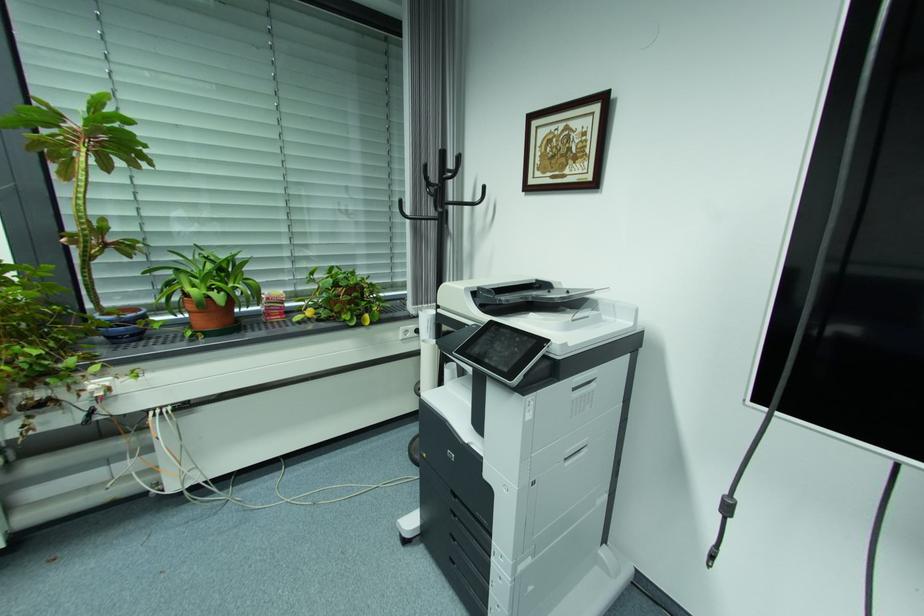
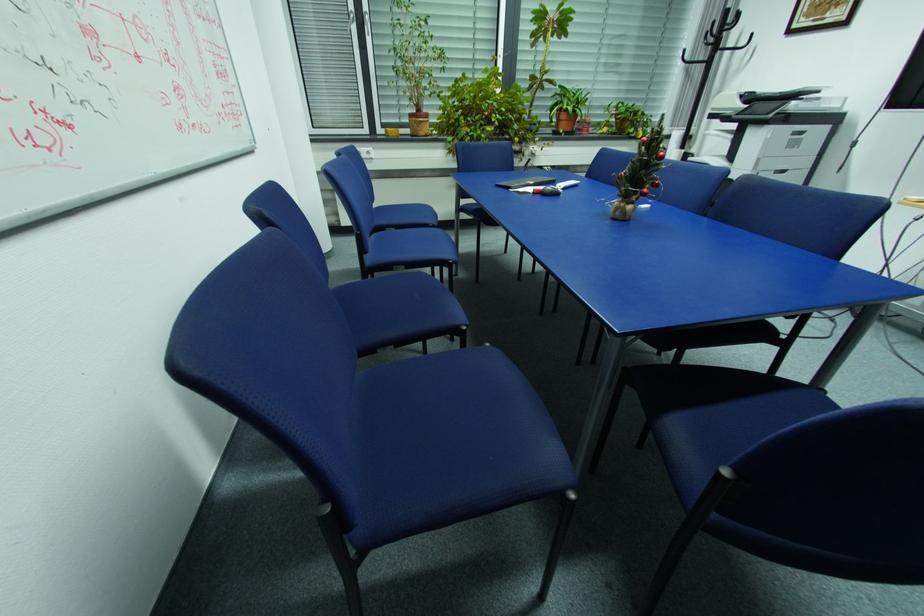
Question: In a continuous first-person perspective shot, in which direction is the camera moving?

Choices:
 (A) Left
 (B) Right
 (C) Forward
 (D) Backward

Answer: (D)